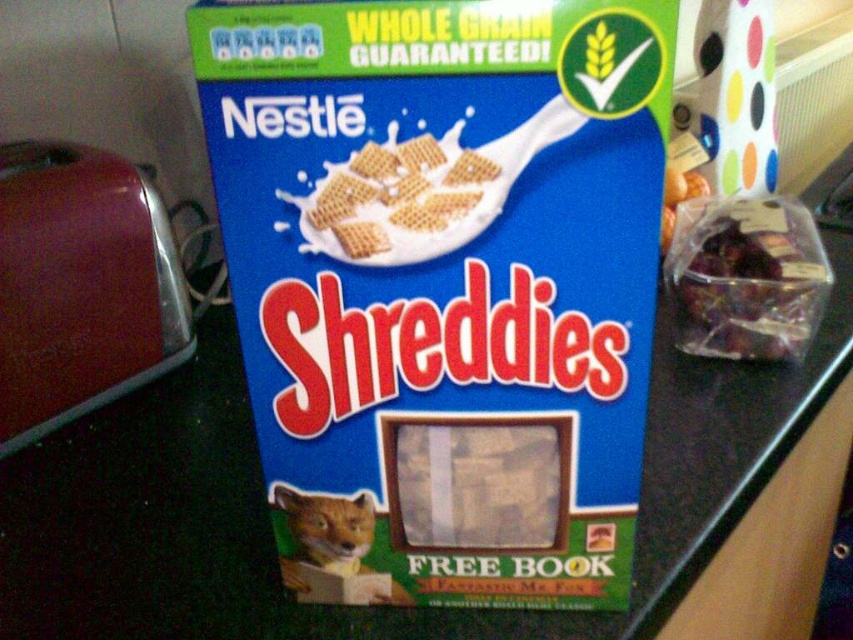
In the scene shown: You are organizing the kitchen pantry and notice the blue cardboard box at center and the clear plastic bag of dried fruit at right. Which item is positioned lower in the pantry shelf?

The blue cardboard box at center is located below the clear plastic bag of dried fruit at right, so it is positioned lower in the pantry shelf.

You are a cat owner who wants to feed your orange fur cat at lower left with some dried fruit from the clear plastic bag of dried fruit at right. The cat is curious and might jump towards the bag. Given that the cat can jump 18 inches, will it be able to reach the bag?

The clear plastic bag of dried fruit at right and orange fur cat at lower left are 17.57 inches apart. Since the cat can jump 18 inches, it can reach the bag.

You are a cat owner who wants to place the orange fur cat at lower left near the clear plastic bag of dried fruit at right. Based on the scene, is the cat currently closer to the bag than the edge of the countertop?

The clear plastic bag of dried fruit at right is further to the viewer than orange fur cat at lower left, meaning the cat is closer to the edge of the countertop than the bag. Therefore, the cat is not currently closer to the bag than the edge of the countertop.